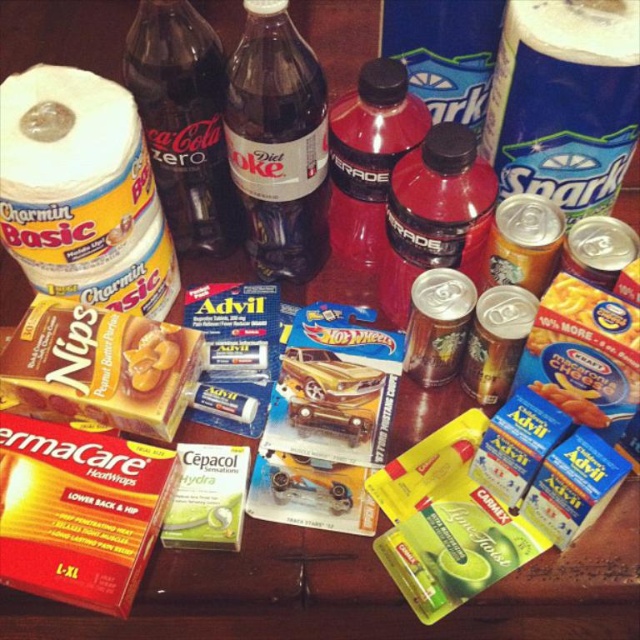
You are organizing a picnic basket and have limited space. You need to choose between the peanut buttery brownies at center and the pink matte gatorade at center based on their sizes. Which item takes up more space?

The peanut buttery brownies at center takes up more space than the pink matte gatorade at center because the peanut buttery brownies at center has a larger width.

You have a small container that can only hold items narrower than the pink matte gatorade at center. Can you safely place the clear plastic bottle at upper right into this container?

The clear plastic bottle at upper right has a width larger than the pink matte gatorade at center. Since the container can only hold items narrower than the pink matte gatorade at center, the clear plastic bottle at upper right cannot fit into the container.

You are organizing items on a dark wooden surface. You need to place a new item between the diet coke bottle at upper center and the dark glass bottle at center. Which object should be placed closer to you to ensure proper spacing?

The diet coke bottle at upper center is closer to the viewer than the dark glass bottle at center, so you should place the new item closer to the dark glass bottle at center to maintain equal distance between both objects.